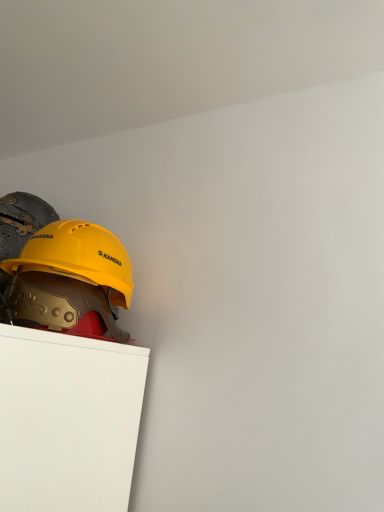
Identify the location of yellow matte hard hat at left, arranged as the first helmet when viewed from the front. The height and width of the screenshot is (512, 384). (21, 221).

The width and height of the screenshot is (384, 512). What do you see at coordinates (21, 221) in the screenshot?
I see `yellow matte hard hat at left, arranged as the first helmet when viewed from the front` at bounding box center [21, 221].

How much space does yellow matte hard hat at left, arranged as the first helmet when viewed from the front, occupy horizontally?

The width of yellow matte hard hat at left, arranged as the first helmet when viewed from the front, is 6.17 inches.

I want to click on yellow hard hat at upper left, acting as the 2th helmet starting from the front, so click(70, 277).

Image resolution: width=384 pixels, height=512 pixels. Describe the element at coordinates (70, 277) in the screenshot. I see `yellow hard hat at upper left, acting as the 2th helmet starting from the front` at that location.

Locate an element on the screen. yellow matte hard hat at left, arranged as the first helmet when viewed from the front is located at coordinates (21, 221).

Is yellow matte hard hat at left, arranged as the first helmet when viewed from the front, to the left of yellow hard hat at upper left, acting as the 2th helmet starting from the front, from the viewer's perspective?

Yes, yellow matte hard hat at left, arranged as the first helmet when viewed from the front, is to the left of yellow hard hat at upper left, acting as the 2th helmet starting from the front.

Does yellow matte hard hat at left, positioned as the second helmet in back-to-front order, lie in front of yellow hard hat at upper left, the first helmet in the back-to-front sequence?

Yes, it is.

Is point (11, 219) more distant than point (37, 243)?

Yes, point (11, 219) is behind point (37, 243).

From the image's perspective, relative to yellow hard hat at upper left, acting as the 2th helmet starting from the front, is yellow matte hard hat at left, arranged as the first helmet when viewed from the front, above or below?

yellow matte hard hat at left, arranged as the first helmet when viewed from the front, is above yellow hard hat at upper left, acting as the 2th helmet starting from the front.

From a real-world perspective, who is located lower, yellow matte hard hat at left, positioned as the second helmet in back-to-front order, or yellow hard hat at upper left, the first helmet in the back-to-front sequence?

yellow matte hard hat at left, positioned as the second helmet in back-to-front order, from a real-world perspective.

Considering the relative sizes of yellow matte hard hat at left, arranged as the first helmet when viewed from the front, and yellow hard hat at upper left, the first helmet in the back-to-front sequence, in the image provided, is yellow matte hard hat at left, arranged as the first helmet when viewed from the front, thinner than yellow hard hat at upper left, the first helmet in the back-to-front sequence,?

Yes, yellow matte hard hat at left, arranged as the first helmet when viewed from the front, is thinner than yellow hard hat at upper left, the first helmet in the back-to-front sequence.

Which of these two, yellow matte hard hat at left, positioned as the second helmet in back-to-front order, or yellow hard hat at upper left, the first helmet in the back-to-front sequence, stands taller?

Standing taller between the two is yellow hard hat at upper left, the first helmet in the back-to-front sequence.

Between yellow matte hard hat at left, positioned as the second helmet in back-to-front order, and yellow hard hat at upper left, acting as the 2th helmet starting from the front, which one has larger size?

yellow hard hat at upper left, acting as the 2th helmet starting from the front.

Would you say yellow matte hard hat at left, arranged as the first helmet when viewed from the front, is inside or outside yellow hard hat at upper left, the first helmet in the back-to-front sequence?

The correct answer is: outside.

Is the surface of yellow matte hard hat at left, arranged as the first helmet when viewed from the front, in direct contact with yellow hard hat at upper left, acting as the 2th helmet starting from the front?

No.

Is yellow matte hard hat at left, positioned as the second helmet in back-to-front order, aimed at yellow hard hat at upper left, the first helmet in the back-to-front sequence?

No, yellow matte hard hat at left, positioned as the second helmet in back-to-front order, is not facing towards yellow hard hat at upper left, the first helmet in the back-to-front sequence.

This screenshot has height=512, width=384. Identify the location of helmet to the left of yellow hard hat at upper left, the first helmet in the back-to-front sequence. (21, 221).

In the image, is yellow hard hat at upper left, the first helmet in the back-to-front sequence, on the left side or the right side of yellow matte hard hat at left, arranged as the first helmet when viewed from the front?

From the image, it's evident that yellow hard hat at upper left, the first helmet in the back-to-front sequence, is to the right of yellow matte hard hat at left, arranged as the first helmet when viewed from the front.

Is yellow hard hat at upper left, the first helmet in the back-to-front sequence, further to the viewer compared to yellow matte hard hat at left, arranged as the first helmet when viewed from the front?

Yes, it is behind yellow matte hard hat at left, arranged as the first helmet when viewed from the front.

Which point is more forward, (104,256) or (7,314)?

The point (7,314) is more forward.

From the image's perspective, which is below, yellow hard hat at upper left, the first helmet in the back-to-front sequence, or yellow matte hard hat at left, positioned as the second helmet in back-to-front order?

yellow hard hat at upper left, the first helmet in the back-to-front sequence, is shown below in the image.

From a real-world perspective, between yellow hard hat at upper left, acting as the 2th helmet starting from the front, and yellow matte hard hat at left, positioned as the second helmet in back-to-front order, who is vertically lower?

yellow matte hard hat at left, positioned as the second helmet in back-to-front order, is physically lower.

Does yellow hard hat at upper left, acting as the 2th helmet starting from the front, have a greater width compared to yellow matte hard hat at left, positioned as the second helmet in back-to-front order?

Yes, yellow hard hat at upper left, acting as the 2th helmet starting from the front, is wider than yellow matte hard hat at left, positioned as the second helmet in back-to-front order.

In the scene shown: Which of these two, yellow hard hat at upper left, the first helmet in the back-to-front sequence, or yellow matte hard hat at left, arranged as the first helmet when viewed from the front, stands shorter?

With less height is yellow matte hard hat at left, arranged as the first helmet when viewed from the front.

Between yellow hard hat at upper left, the first helmet in the back-to-front sequence, and yellow matte hard hat at left, positioned as the second helmet in back-to-front order, which one has larger size?

With larger size is yellow hard hat at upper left, the first helmet in the back-to-front sequence.

Is yellow hard hat at upper left, acting as the 2th helmet starting from the front, completely or partially outside of yellow matte hard hat at left, arranged as the first helmet when viewed from the front?

Yes, yellow hard hat at upper left, acting as the 2th helmet starting from the front, is outside of yellow matte hard hat at left, arranged as the first helmet when viewed from the front.

Are yellow hard hat at upper left, the first helmet in the back-to-front sequence, and yellow matte hard hat at left, positioned as the second helmet in back-to-front order, located far from each other?

They are positioned close to each other.

Is yellow hard hat at upper left, the first helmet in the back-to-front sequence, oriented towards yellow matte hard hat at left, arranged as the first helmet when viewed from the front?

Yes, yellow hard hat at upper left, the first helmet in the back-to-front sequence, is oriented towards yellow matte hard hat at left, arranged as the first helmet when viewed from the front.

At what (x,y) coordinates should I click in order to perform the action: click on helmet above the yellow hard hat at upper left, the first helmet in the back-to-front sequence (from the image's perspective). Please return your answer as a coordinate pair (x, y). This screenshot has width=384, height=512. Looking at the image, I should click on (21, 221).

Locate an element on the screen. helmet above the yellow hard hat at upper left, the first helmet in the back-to-front sequence (from the image's perspective) is located at coordinates (21, 221).

Image resolution: width=384 pixels, height=512 pixels. There is a yellow matte hard hat at left, positioned as the second helmet in back-to-front order. Find the location of `helmet above it (from a real-world perspective)`. helmet above it (from a real-world perspective) is located at coordinates (70, 277).